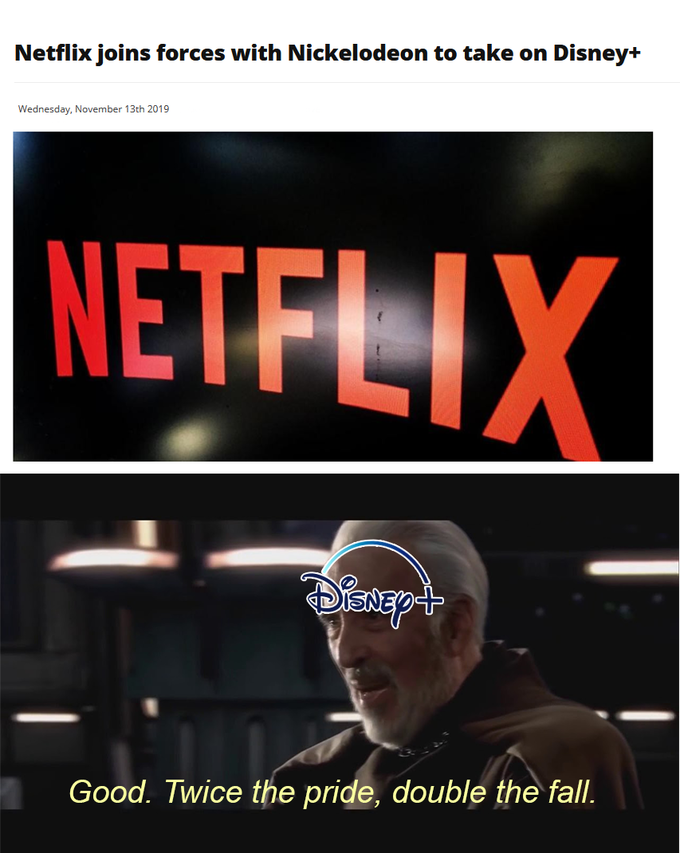
Identify the location of lights. (124, 564), (239, 554), (585, 577), (649, 717), (343, 716), (43, 722).